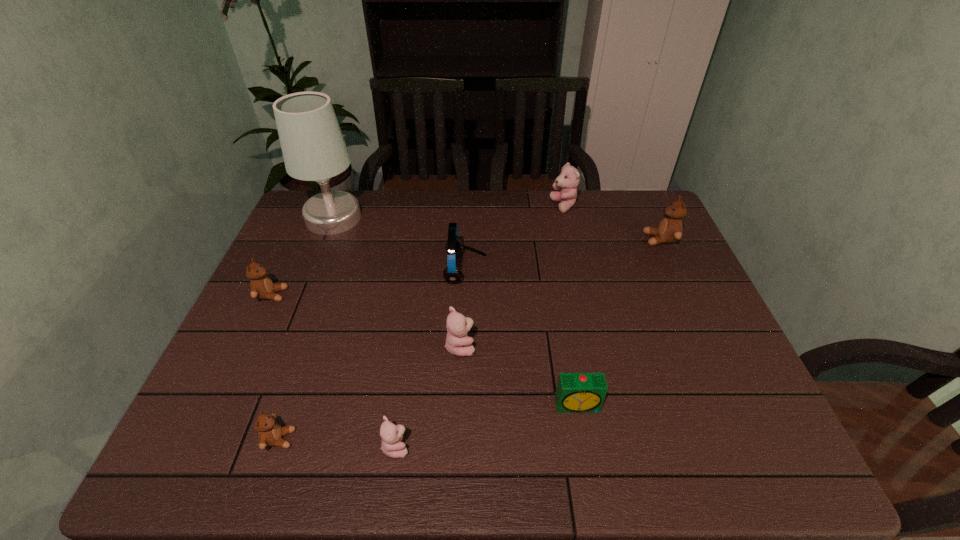
This screenshot has width=960, height=540. I want to click on the tallest object, so click(x=313, y=147).

At what (x,y) coordinates should I click in order to perform the action: click on gray lampshade. Please return your answer as a coordinate pair (x, y). This screenshot has width=960, height=540. Looking at the image, I should click on (313, 147).

The width and height of the screenshot is (960, 540). In order to click on the farthest pink teddy bear in this screenshot , I will do `click(568, 180)`.

Find the location of a particular element. the rightmost pink teddy bear is located at coordinates (568, 180).

Locate an element on the screen. The image size is (960, 540). the biggest brown teddy bear is located at coordinates (670, 229).

Where is `the second farthest teddy bear`? the second farthest teddy bear is located at coordinates (670, 229).

At what (x,y) coordinates should I click in order to perform the action: click on headset. Please return your answer as a coordinate pair (x, y). Looking at the image, I should click on (454, 246).

Find the location of a particular element. The width and height of the screenshot is (960, 540). the leftmost brown teddy bear is located at coordinates point(261,286).

The image size is (960, 540). In order to click on the second farthest brown teddy bear in this screenshot , I will do `click(261, 286)`.

Find the location of a particular element. This screenshot has height=540, width=960. the fourth teddy bear from left to right is located at coordinates tap(458, 343).